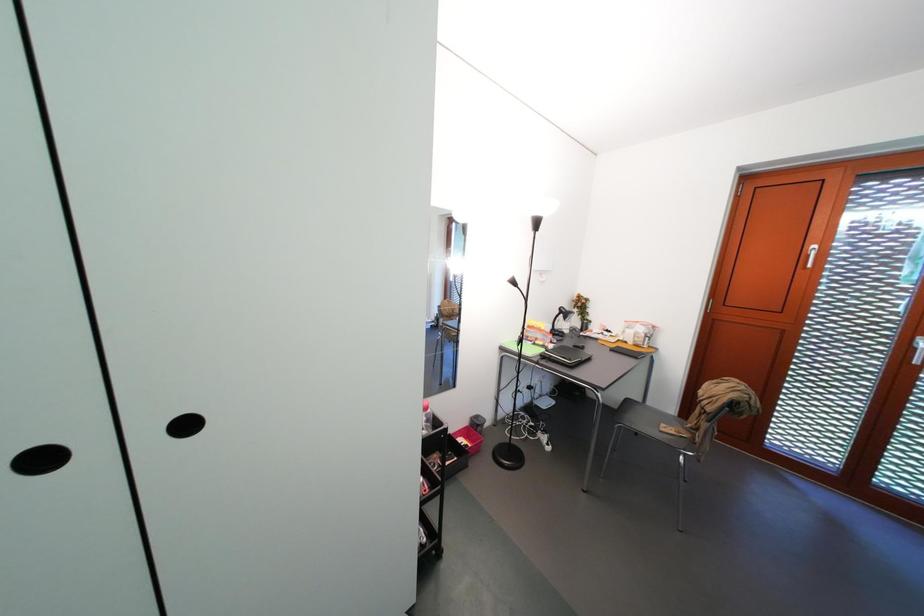
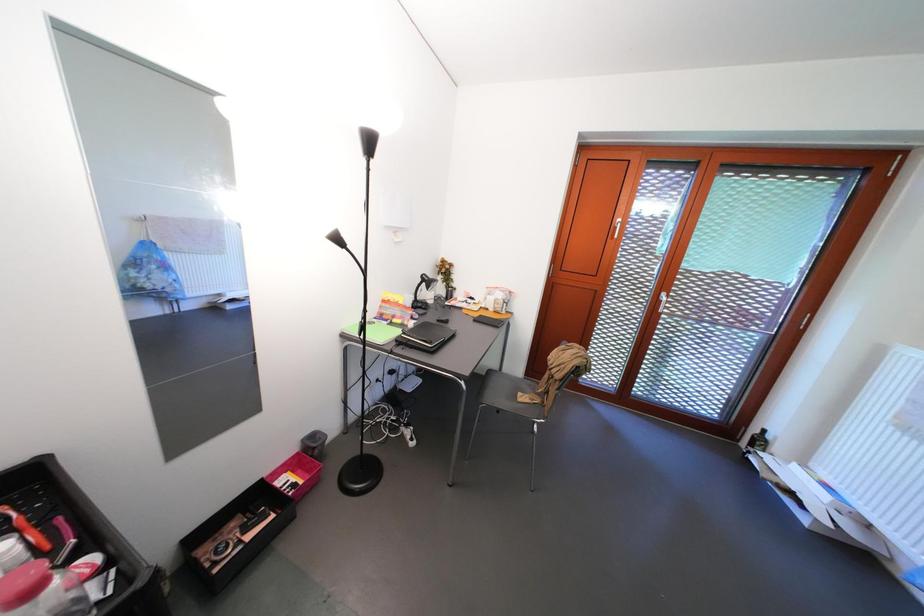
Question: The camera is either moving clockwise (left) or counter-clockwise (right) around the object. The first image is from the beginning of the video and the second image is from the end. Is the camera moving left or right when shooting the video?

Choices:
 (A) Left
 (B) Right

Answer: (A)